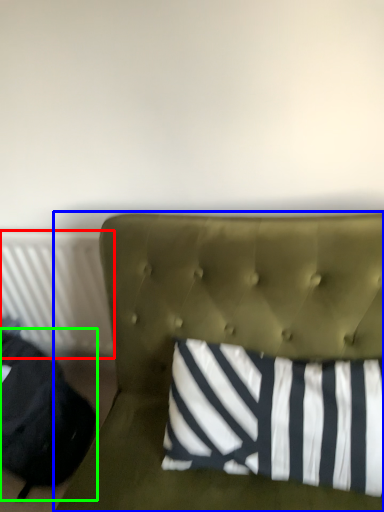
Question: Which object is the closest to the radiator (highlighted by a red box)? Choose among these: furniture (highlighted by a blue box) or bean bag chair (highlighted by a green box).

Choices:
 (A) furniture
 (B) bean bag chair

Answer: (B)